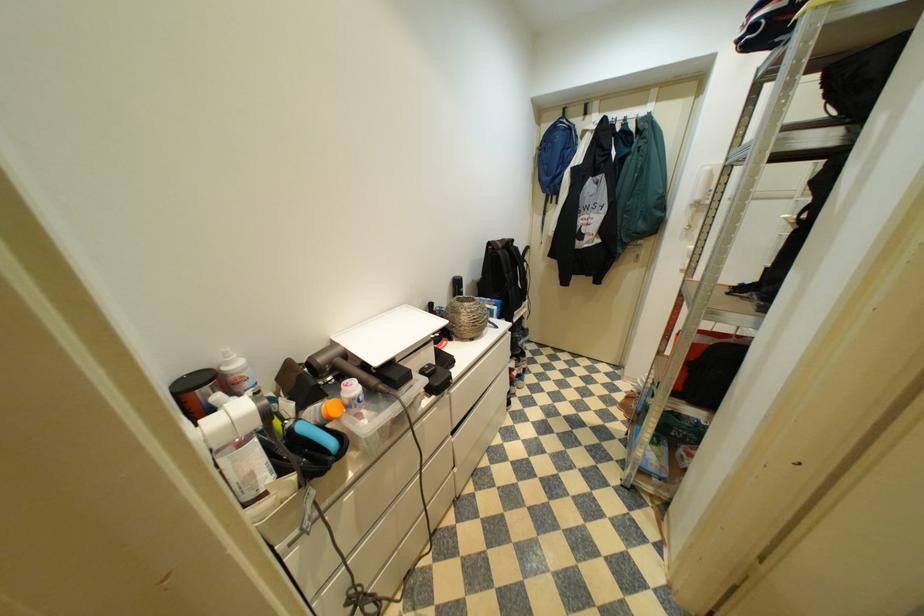
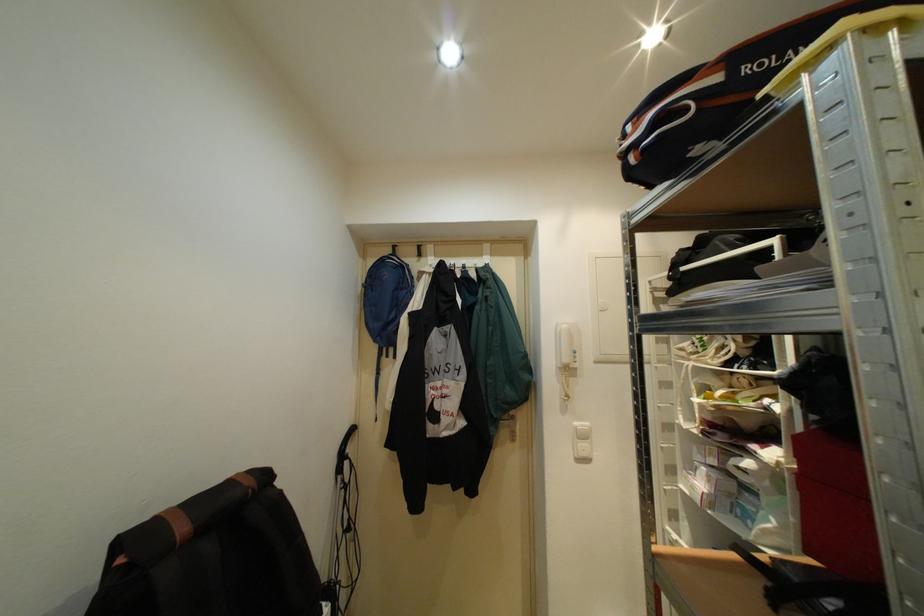
In the second image, find the point that corresponds to point 555,190 in the first image.

(387, 339)